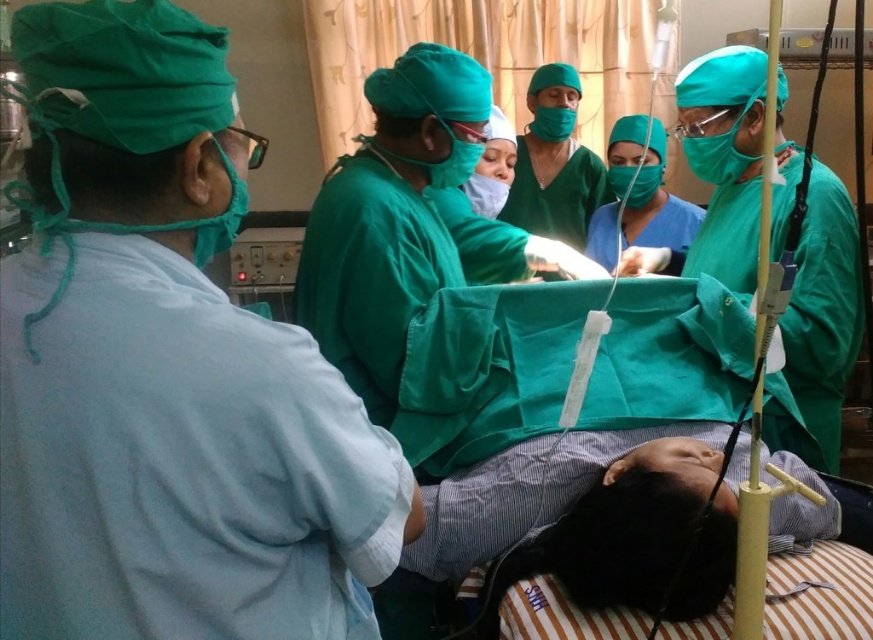
You are a medical student observing a surgery. You need to adjust the camera to capture the matte green gown at left clearly. Considering the camera is currently 27.87 inches away from the gown, is this distance sufficient for a clear photo?

The camera is currently 27.87 inches away from the matte green gown at left, which is sufficient for capturing a clear photo as this distance allows for proper focus and detail capture.

In the scene shown: You are a medical student observing the operation. The head surgeon asks you to locate the matte green gown at left. Based on its coordinates, where exactly is it positioned in the room?

The matte green gown at left is positioned at point 0.577 along the horizontal axis and 0.191 along the vertical axis in the room.